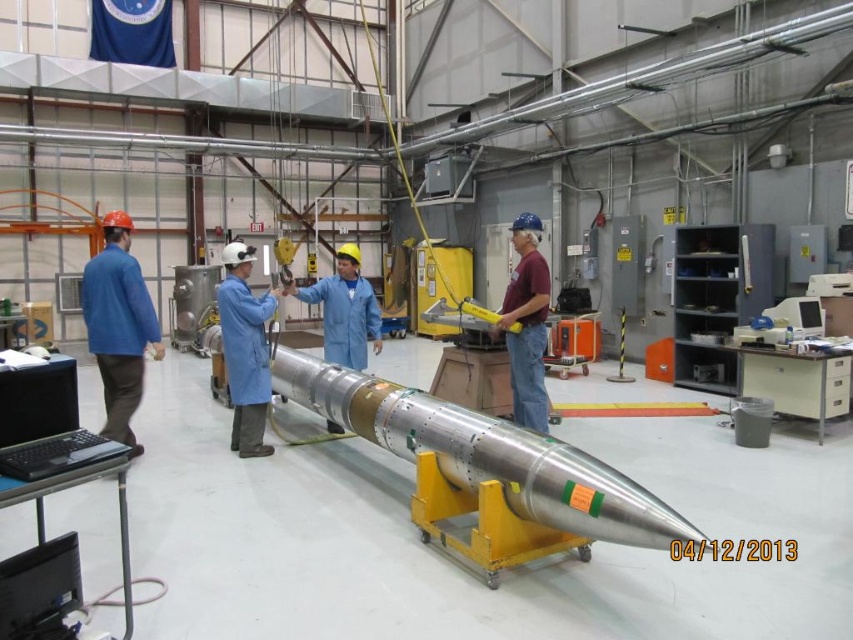
Between blue fabric coat at center and blue coverall at center, which one is positioned higher?

blue coverall at center is higher up.

Is blue fabric coat at center shorter than blue coverall at center?

No.

Is point (260, 364) farther from viewer compared to point (338, 282)?

That is False.

Identify the location of blue fabric coat at center. (245, 349).

This screenshot has width=853, height=640. What do you see at coordinates (486, 452) in the screenshot? I see `metallic silver rocket at center` at bounding box center [486, 452].

Is metallic silver rocket at center in front of maroon fabric shirt at center?

Yes, metallic silver rocket at center is in front of maroon fabric shirt at center.

I want to click on metallic silver rocket at center, so click(486, 452).

Does blue fabric jacket at left have a greater height compared to blue fabric coat at center?

Yes.

Who is more distant from viewer, (161, 356) or (260, 435)?

The point (161, 356) is more distant.

Find the location of a particular element. The height and width of the screenshot is (640, 853). blue fabric jacket at left is located at coordinates (119, 324).